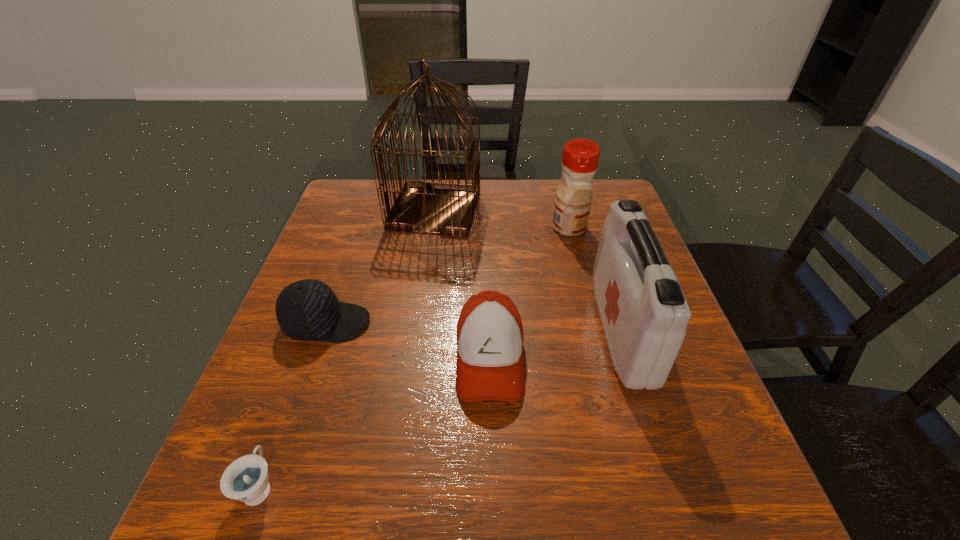
The width and height of the screenshot is (960, 540). I want to click on birdcage, so click(421, 206).

Image resolution: width=960 pixels, height=540 pixels. In order to click on condiment in this screenshot , I will do `click(580, 157)`.

The width and height of the screenshot is (960, 540). Identify the location of the first-aid kit. point(644,314).

You are a GUI agent. You are given a task and a screenshot of the screen. Output one action in this format:
    pyautogui.click(x=<x>, y=<y>)
    Task: Click on the right baseball cap
    The height and width of the screenshot is (540, 960).
    Given the screenshot: What is the action you would take?
    pyautogui.click(x=490, y=366)

You are a GUI agent. You are given a task and a screenshot of the screen. Output one action in this format:
    pyautogui.click(x=<x>, y=<y>)
    Task: Click on the left baseball cap
    
    Given the screenshot: What is the action you would take?
    pyautogui.click(x=307, y=310)

Find the location of `the shorter baseball cap`. the shorter baseball cap is located at coordinates (307, 310).

Identify the location of teacup. The height and width of the screenshot is (540, 960). (246, 479).

Locate an element on the screen. This screenshot has width=960, height=540. the shortest object is located at coordinates (246, 479).

Image resolution: width=960 pixels, height=540 pixels. Find the location of `free space located 0.210m on the right of the birdcage`. free space located 0.210m on the right of the birdcage is located at coordinates point(554,210).

I want to click on vacant space located on the front of the condiment, so click(592, 320).